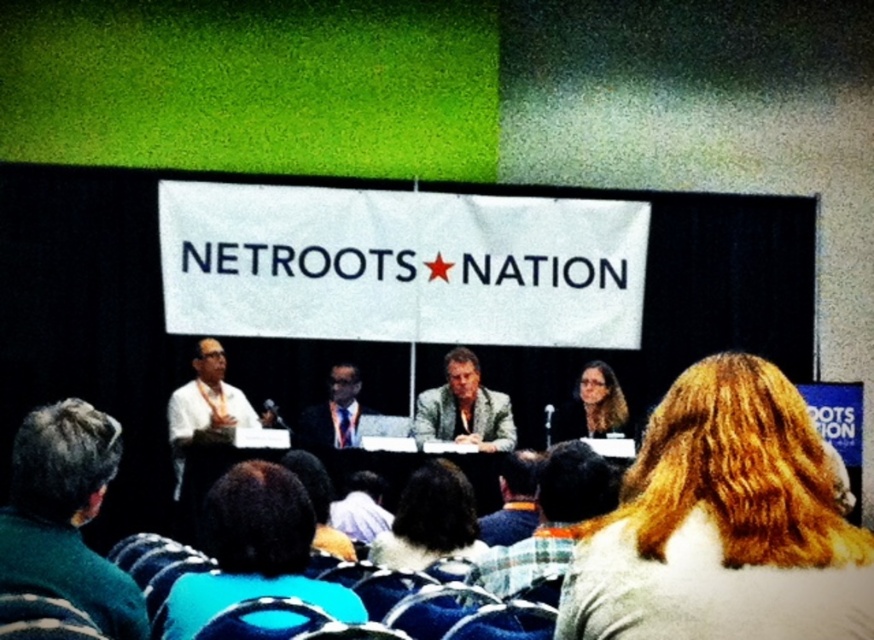
You are a photographer taking a picture of the panel at Netroots Nation. You want to focus on the dark green sweater at lower left and the matte black glasses at center. Which object should you adjust your camera to focus on first if you want to capture both in sharp detail?

The dark green sweater at lower left is closer to the viewer than the matte black glasses at center, so you should focus on the dark green sweater at lower left first to ensure both are in sharp detail.

You are a photographer at the Netroots Nation event. You want to take a photo of the dark green sweater at lower left and the matte black glasses at center so that both objects are clearly visible. Considering their sizes, which object should you focus on to ensure both are in frame?

The dark green sweater at lower left is larger than the matte black glasses at center, so focusing on the dark green sweater at lower left will help ensure both objects are in frame while maintaining clarity.